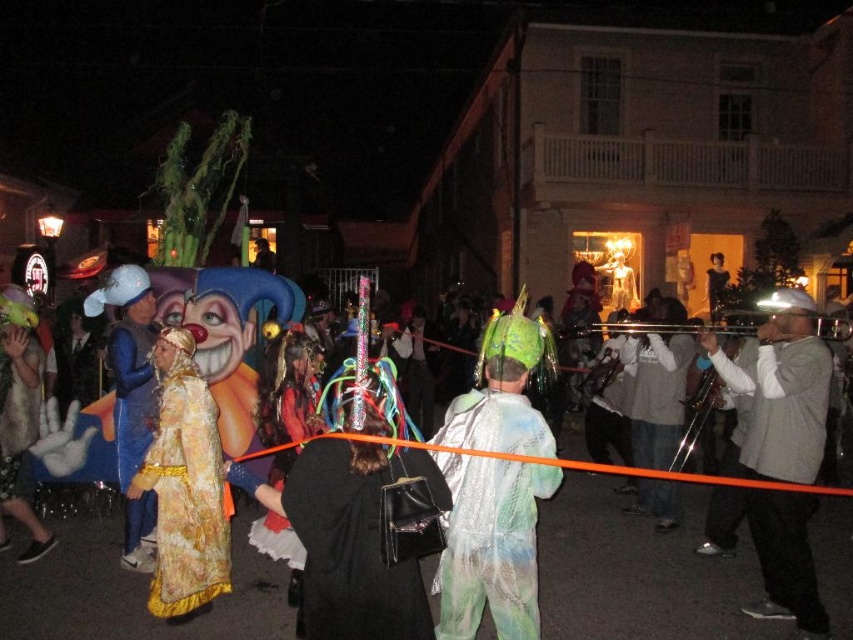
Question: Which object is closer to the camera taking this photo?

Choices:
 (A) shiny silver sequins at center
 (B) black leather bag at center
 (C) blue velvet mask at left

Answer: (A)

Question: Is fuzzy gold fur coat at center smaller than velvet gold dress at center?

Choices:
 (A) no
 (B) yes

Answer: (B)

Question: Which point is closer to the camera taking this photo?

Choices:
 (A) (265, 532)
 (B) (38, 362)
 (C) (56, 524)
 (D) (225, 552)

Answer: (D)

Question: Does shiny silver sequins at center appear over blue velvet mask at left?

Choices:
 (A) no
 (B) yes

Answer: (A)

Question: Among these objects, which one is farthest from the camera?

Choices:
 (A) black leather bag at center
 (B) shiny silver sequins at center
 (C) gold sequined robe at center

Answer: (C)

Question: Where is shiny metallic clown at center located in relation to black leather bag at center in the image?

Choices:
 (A) left
 (B) right

Answer: (B)